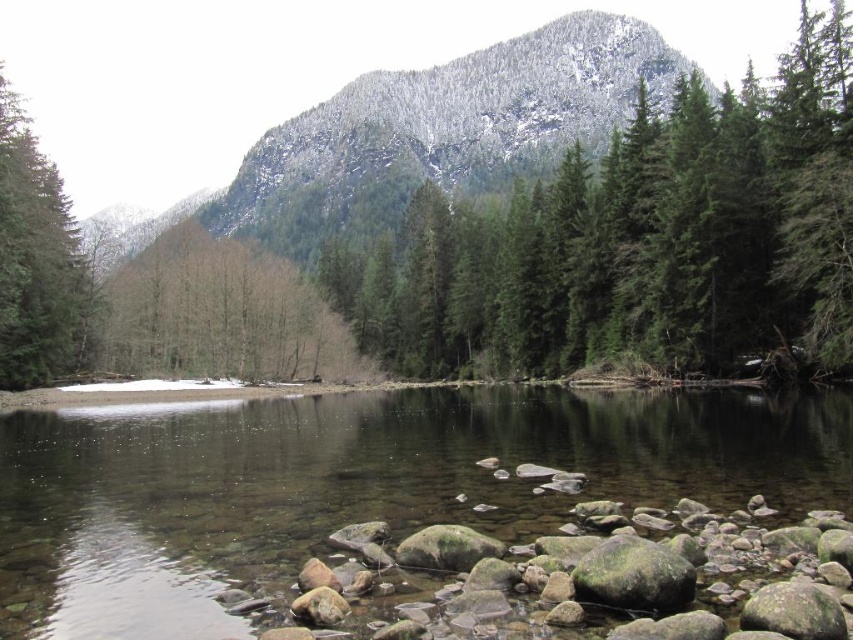
Question: Among these points, which one is farthest from the camera?

Choices:
 (A) (804, 417)
 (B) (407, 99)
 (C) (70, 280)
 (D) (457, 225)

Answer: (B)

Question: Is the position of clear smooth water at center less distant than that of green matte tree at center?

Choices:
 (A) yes
 (B) no

Answer: (A)

Question: Which object is positioned farthest from the clear smooth water at center?

Choices:
 (A) snow-covered rock at upper center
 (B) green matte tree at center

Answer: (A)

Question: Can you confirm if green matte tree at center is positioned to the right of snow-covered rock at upper center?

Choices:
 (A) no
 (B) yes

Answer: (B)

Question: Which of the following is the farthest from the observer?

Choices:
 (A) (683, 212)
 (B) (370, 451)
 (C) (25, 221)

Answer: (A)

Question: Can you confirm if clear smooth water at center is positioned to the right of green matte tree at left?

Choices:
 (A) no
 (B) yes

Answer: (B)